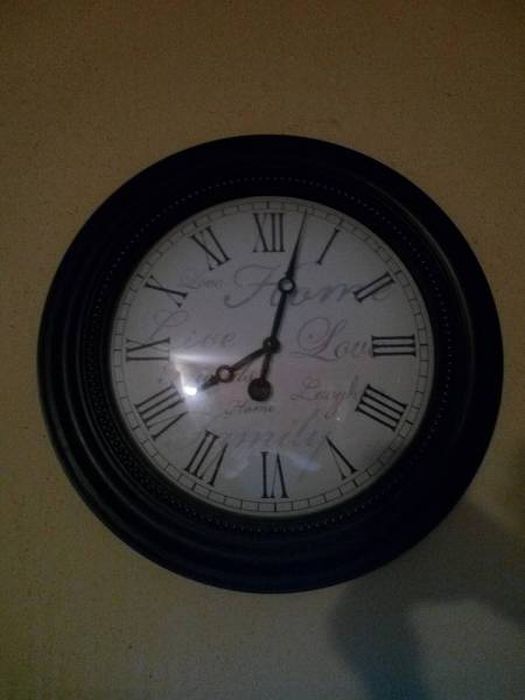
At what (x,y) coordinates should I click in order to perform the action: click on paint. Please return your answer as a coordinate pair (x, y). This screenshot has width=525, height=700. Looking at the image, I should click on (103, 568).